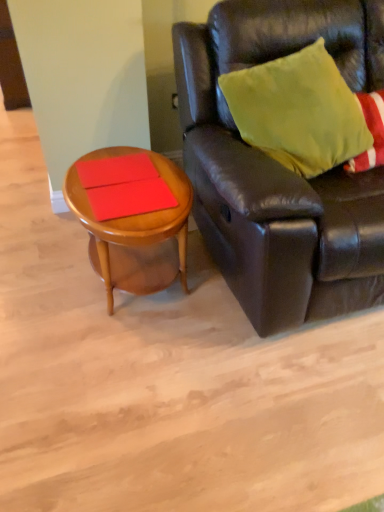
Locate an element on the screen. The height and width of the screenshot is (512, 384). matte red book at left, positioned as the second plank in bottom-to-top order is located at coordinates (115, 170).

Measure the distance between matte red book at center, positioned as the second plank in top-to-bottom order, and camera.

matte red book at center, positioned as the second plank in top-to-bottom order, is 1.37 meters from camera.

How much space does matte red book at center, positioned as the second plank in top-to-bottom order, occupy horizontally?

The width of matte red book at center, positioned as the second plank in top-to-bottom order, is 12.14 inches.

Where is `matte red book at left, positioned as the second plank in bottom-to-top order`? matte red book at left, positioned as the second plank in bottom-to-top order is located at coordinates (115, 170).

Choose the correct answer: Is woodenobject at left inside matte red book at left, the first plank viewed from the top, or outside it?

woodenobject at left is outside matte red book at left, the first plank viewed from the top.

Can you confirm if woodenobject at left is shorter than matte red book at left, the first plank viewed from the top?

No, woodenobject at left is not shorter than matte red book at left, the first plank viewed from the top.

Is point (178, 257) positioned after point (104, 174)?

That is True.

Between woodenobject at left and matte red book at left, the first plank viewed from the top, which one is positioned in front?

woodenobject at left is in front.

From the image's perspective, which is above, matte red book at left, positioned as the second plank in bottom-to-top order, or woodenobject at left?

matte red book at left, positioned as the second plank in bottom-to-top order, from the image's perspective.

Between matte red book at left, the first plank viewed from the top, and woodenobject at left, which one has smaller size?

With smaller size is matte red book at left, the first plank viewed from the top.

From a real-world perspective, who is located higher, matte red book at left, positioned as the second plank in bottom-to-top order, or woodenobject at left?

From a 3D spatial view, matte red book at left, positioned as the second plank in bottom-to-top order, is above.

Is matte red book at left, the first plank viewed from the top, at the left side of woodenobject at left?

Correct, you'll find matte red book at left, the first plank viewed from the top, to the left of woodenobject at left.

Does woodenobject at left turn towards leather couch at right?

No, woodenobject at left is not aimed at leather couch at right.

Who is taller, woodenobject at left or leather couch at right?

leather couch at right is taller.

From the image's perspective, is woodenobject at left beneath leather couch at right?

Yes.

Consider the image. From a real-world perspective, is woodenobject at left on leather couch at right?

No.

Where is `plank that is the 2nd object to the left of the leather couch at right, starting at the anchor`? plank that is the 2nd object to the left of the leather couch at right, starting at the anchor is located at coordinates (115, 170).

Between matte red book at left, the first plank viewed from the top, and leather couch at right, which one has smaller size?

matte red book at left, the first plank viewed from the top, is smaller.

Is matte red book at left, positioned as the second plank in bottom-to-top order, not within leather couch at right?

matte red book at left, positioned as the second plank in bottom-to-top order, is positioned outside leather couch at right.

Is matte red book at left, positioned as the second plank in bottom-to-top order, far away from leather couch at right?

matte red book at left, positioned as the second plank in bottom-to-top order, is near leather couch at right, not far away.

Locate an element on the screen. The height and width of the screenshot is (512, 384). studio couch lying above the matte red book at center, positioned as the second plank in top-to-bottom order (from the image's perspective) is located at coordinates (281, 167).

From a real-world perspective, relative to matte red book at center, positioned as the second plank in top-to-bottom order, is leather couch at right vertically above or below?

From a real-world perspective, leather couch at right is physically above matte red book at center, positioned as the second plank in top-to-bottom order.

Is leather couch at right not near matte red book at center, positioned as the second plank in top-to-bottom order?

No.

Looking at their sizes, would you say leather couch at right is wider or thinner than matte red book at center, positioned as the 1th plank in bottom-to-top order?

In the image, leather couch at right appears to be wider than matte red book at center, positioned as the 1th plank in bottom-to-top order.

Where is `studio couch in front of the matte red book at center, positioned as the 1th plank in bottom-to-top order`? This screenshot has height=512, width=384. studio couch in front of the matte red book at center, positioned as the 1th plank in bottom-to-top order is located at coordinates (281, 167).

In the scene shown: Considering the relative sizes of matte red book at center, positioned as the second plank in top-to-bottom order, and leather couch at right in the image provided, is matte red book at center, positioned as the second plank in top-to-bottom order, bigger than leather couch at right?

Actually, matte red book at center, positioned as the second plank in top-to-bottom order, might be smaller than leather couch at right.

Is matte red book at center, positioned as the 1th plank in bottom-to-top order, wider than leather couch at right?

No.

Is matte red book at center, positioned as the second plank in top-to-bottom order, completely or partially outside of leather couch at right?

Indeed, matte red book at center, positioned as the second plank in top-to-bottom order, is completely outside leather couch at right.

Does woodenobject at left come behind matte red book at center, positioned as the 1th plank in bottom-to-top order?

No, woodenobject at left is closer to the camera.

Based on the photo, could you measure the distance between woodenobject at left and matte red book at center, positioned as the second plank in top-to-bottom order?

woodenobject at left is 6.03 inches from matte red book at center, positioned as the second plank in top-to-bottom order.

Could you tell me if woodenobject at left is turned towards matte red book at center, positioned as the second plank in top-to-bottom order?

No, woodenobject at left is not oriented towards matte red book at center, positioned as the second plank in top-to-bottom order.

Which of these two, woodenobject at left or matte red book at center, positioned as the 1th plank in bottom-to-top order, is wider?

woodenobject at left is wider.

At what (x,y) coordinates should I click in order to perform the action: click on plank that is the 2nd one when counting upward from the woodenobject at left (from the image's perspective). Please return your answer as a coordinate pair (x, y). The height and width of the screenshot is (512, 384). Looking at the image, I should click on (115, 170).

This screenshot has width=384, height=512. In order to click on coffee table on the right of matte red book at left, the first plank viewed from the top in this screenshot , I will do `click(136, 232)`.

From the image, which object appears to be farther from woodenobject at left, matte red book at left, positioned as the second plank in bottom-to-top order, or leather couch at right?

leather couch at right is further to woodenobject at left.

Based on their spatial positions, is woodenobject at left or matte red book at left, the first plank viewed from the top, further from leather couch at right?

The object further to leather couch at right is matte red book at left, the first plank viewed from the top.

Based on their spatial positions, is woodenobject at left or leather couch at right closer to matte red book at center, positioned as the second plank in top-to-bottom order?

woodenobject at left is positioned closer to the anchor matte red book at center, positioned as the second plank in top-to-bottom order.

When comparing their distances from leather couch at right, does woodenobject at left or matte red book at center, positioned as the second plank in top-to-bottom order, seem further?

matte red book at center, positioned as the second plank in top-to-bottom order, is further to leather couch at right.

When comparing their distances from matte red book at center, positioned as the 1th plank in bottom-to-top order, does matte red book at left, positioned as the second plank in bottom-to-top order, or leather couch at right seem further?

The object further to matte red book at center, positioned as the 1th plank in bottom-to-top order, is leather couch at right.

Estimate the real-world distances between objects in this image. Which object is closer to woodenobject at left, matte red book at left, the first plank viewed from the top, or matte red book at center, positioned as the second plank in top-to-bottom order?

matte red book at center, positioned as the second plank in top-to-bottom order.

Estimate the real-world distances between objects in this image. Which object is further from matte red book at center, positioned as the 1th plank in bottom-to-top order, woodenobject at left or matte red book at left, the first plank viewed from the top?

Based on the image, woodenobject at left appears to be further to matte red book at center, positioned as the 1th plank in bottom-to-top order.

When comparing their distances from woodenobject at left, does leather couch at right or matte red book at left, positioned as the second plank in bottom-to-top order, seem further?

Among the two, leather couch at right is located further to woodenobject at left.

Locate an element on the screen. This screenshot has height=512, width=384. plank positioned between woodenobject at left and matte red book at left, the first plank viewed from the top, from near to far is located at coordinates (130, 198).

Locate an element on the screen. The width and height of the screenshot is (384, 512). plank between woodenobject at left and leather couch at right from left to right is located at coordinates (130, 198).

Where is `plank situated between matte red book at left, positioned as the second plank in bottom-to-top order, and leather couch at right from left to right`? plank situated between matte red book at left, positioned as the second plank in bottom-to-top order, and leather couch at right from left to right is located at coordinates (130, 198).

Locate an element on the screen. The height and width of the screenshot is (512, 384). coffee table located between matte red book at left, the first plank viewed from the top, and leather couch at right in the left-right direction is located at coordinates (136, 232).